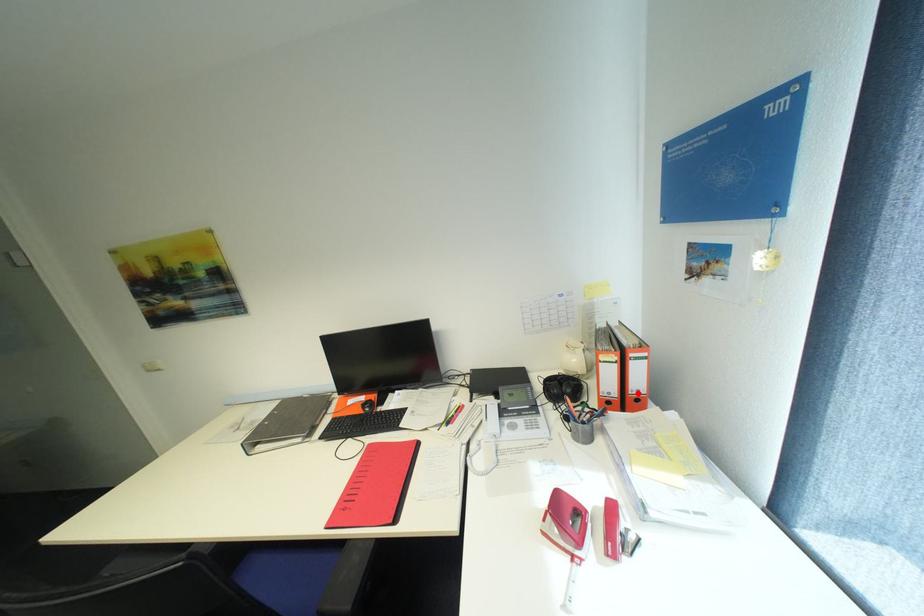
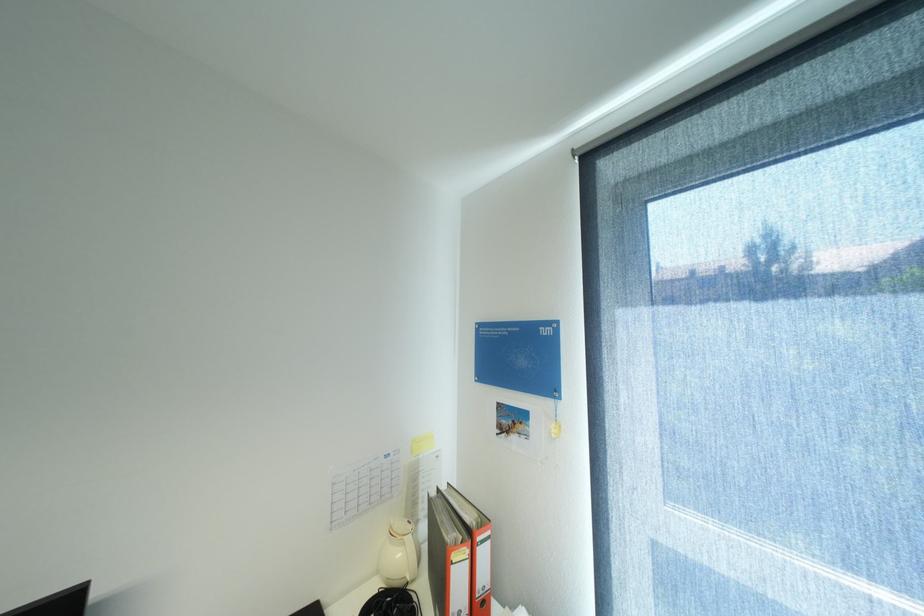
The point at the highlighted location is marked in the first image. Where is the corresponding point in the second image?

(484, 597)